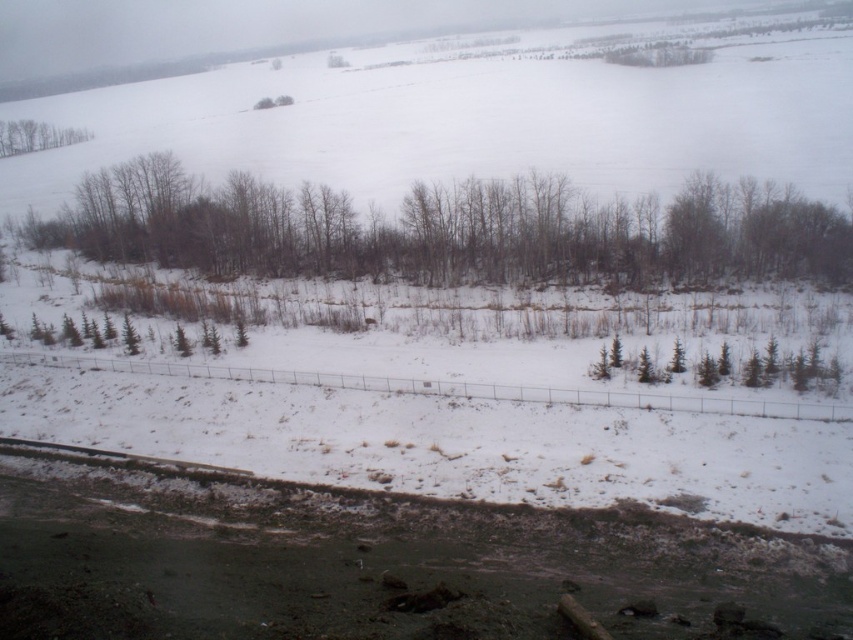
Question: Which object is closer to the camera taking this photo?

Choices:
 (A) brown/dry wood trees at center
 (B) green matte trees at upper left
 (C) metallic wire fence at center

Answer: (C)

Question: Does brown/dry wood trees at center appear on the left side of metallic wire fence at center?

Choices:
 (A) no
 (B) yes

Answer: (B)

Question: Does brown/dry wood trees at center come in front of green matte trees at upper left?

Choices:
 (A) yes
 (B) no

Answer: (A)

Question: Which of the following is the closest to the observer?

Choices:
 (A) (828, 260)
 (B) (265, 369)

Answer: (B)

Question: Can you confirm if brown/dry wood trees at center is thinner than green matte trees at upper left?

Choices:
 (A) no
 (B) yes

Answer: (A)

Question: Which object is positioned closest to the green matte trees at upper left?

Choices:
 (A) brown/dry wood trees at center
 (B) metallic wire fence at center

Answer: (A)